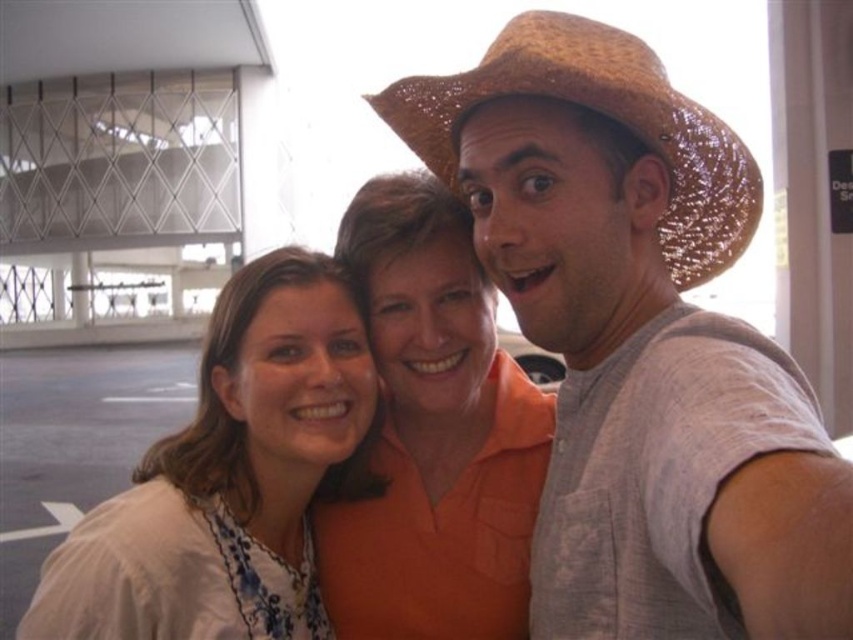
Identify the location of straw hat at upper right. (639, 342).

Which of these two, straw hat at upper right or orange cotton shirt at center, stands shorter?

Standing shorter between the two is orange cotton shirt at center.

Identify the location of straw hat at upper right. This screenshot has width=853, height=640. (639, 342).

Who is taller, white fabric at center or orange cotton shirt at center?

orange cotton shirt at center is taller.

The image size is (853, 640). In order to click on white fabric at center in this screenshot , I will do `click(231, 476)`.

Is point (456, 598) in front of point (402, 106)?

No.

Describe the element at coordinates (434, 435) in the screenshot. I see `orange cotton shirt at center` at that location.

Is point (512, 516) positioned before point (392, 108)?

That is False.

I want to click on orange cotton shirt at center, so click(434, 435).